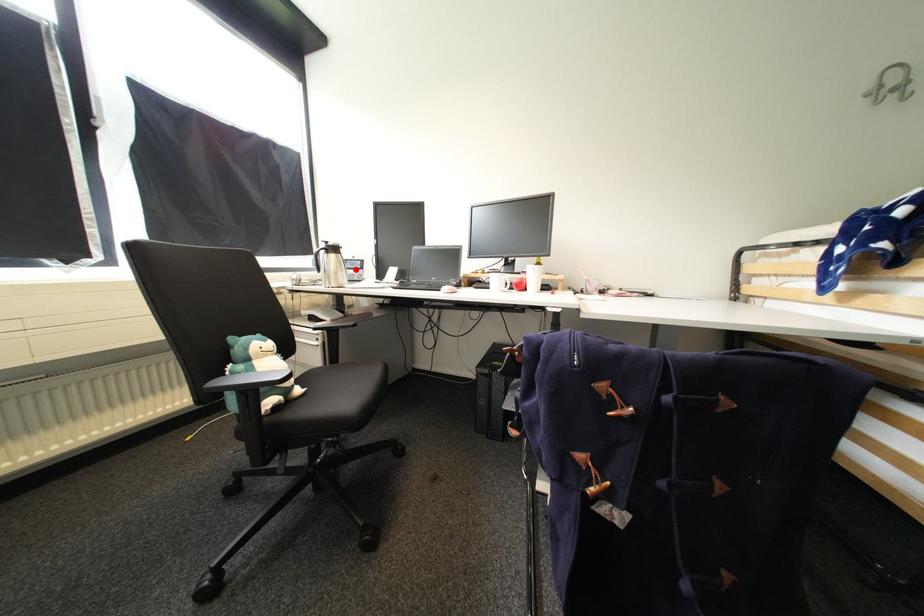
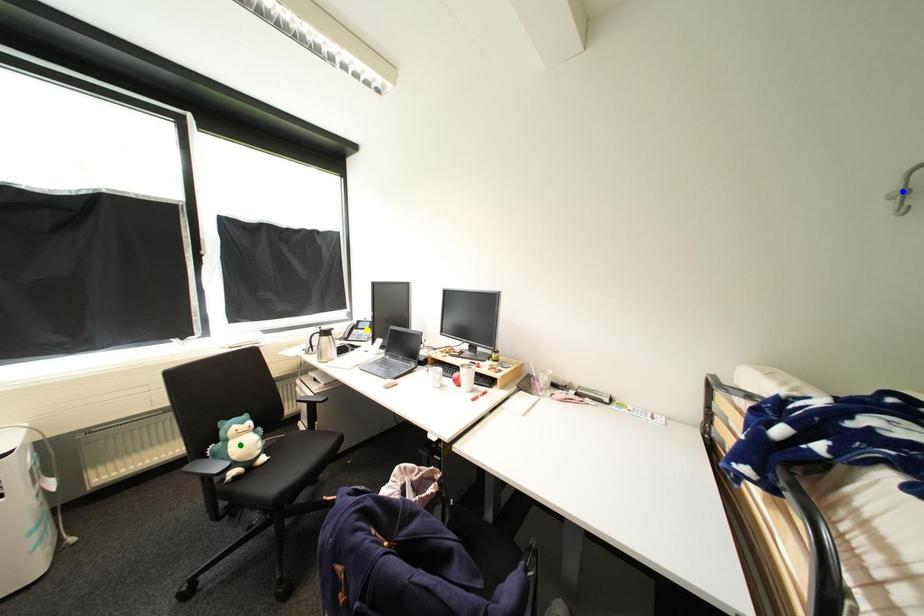
Question: I am providing you with two images of the same scene from different viewpoints. A red point is marked on the first image. You are given multiple points on the second image. Which spot in image 2 lines up with the point in image 1?

Choices:
 (A) blue point
 (B) green point
 (C) yellow point

Answer: (C)